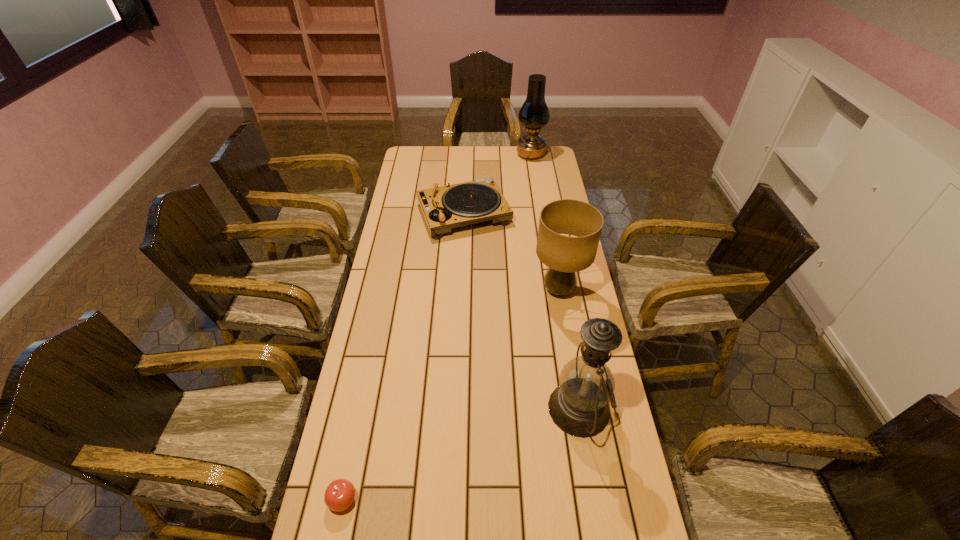
Locate an element on the screen. This screenshot has width=960, height=540. free space located on the back of the second object from left to right is located at coordinates (466, 160).

Identify the location of vacant space situated 0.110m on the back of the apple. (354, 442).

Identify the location of object that is at the far edge. The width and height of the screenshot is (960, 540). (534, 114).

Identify the location of record player present at the left edge. (444, 208).

Locate an element on the screen. The height and width of the screenshot is (540, 960). apple that is at the left edge is located at coordinates (x=339, y=495).

The height and width of the screenshot is (540, 960). I want to click on lampshade that is positioned at the right edge, so click(564, 255).

The image size is (960, 540). I want to click on object present at the far right corner, so click(x=534, y=114).

Locate an element on the screen. The image size is (960, 540). blank space at the far edge is located at coordinates (445, 147).

The image size is (960, 540). Find the location of `vacant space at the left edge of the desktop`. vacant space at the left edge of the desktop is located at coordinates (343, 520).

Where is `free space at the right edge`? The image size is (960, 540). free space at the right edge is located at coordinates (534, 226).